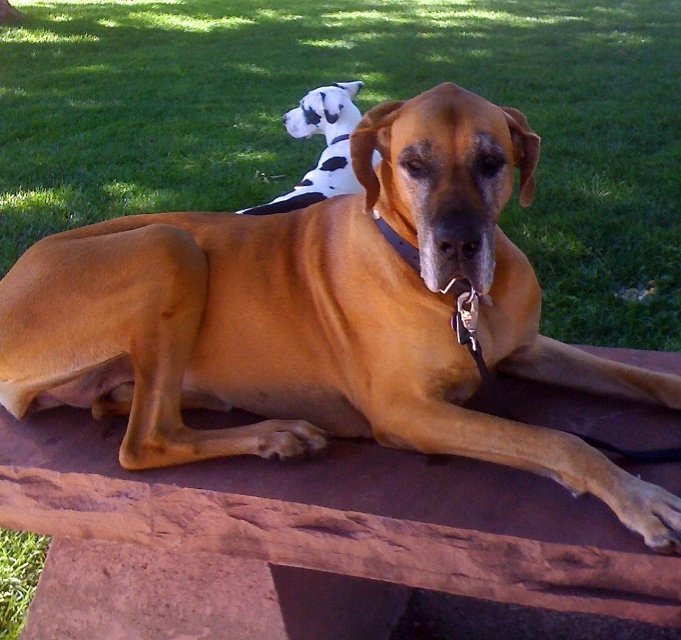
You are a dog owner who wants to throw a ball for your dogs. You see the green grass at upper center and the black and white plush toy at upper center. Which direction should you aim to throw the ball so that it lands between them?

To throw the ball between the green grass at upper center and the black and white plush toy at upper center, aim towards the space between them where the green grass at upper center is on the left side of the black and white plush toy at upper center.

You are a dog owner who wants to place a new dog bed for the brown smooth dog at center. The black and white plush toy at upper center is already there. Where should you place the new bed so it is to the left of the toy?

Place the new bed to the left of the black and white plush toy at upper center, since the brown smooth dog at center is already to the right of the toy, so placing the bed to the left would be a suitable location.

You are standing in front of the two dogs on the patio. There are two points marked on the image. One is at coordinate point [323,364] and the other is at point [616,316]. Which point is closer to you?

Point [323,364] is closer to the camera than point [616,316].